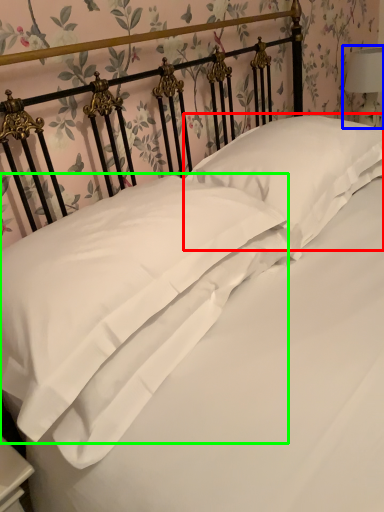
Question: Which is farther away from pillow (highlighted by a red box)? bedside lamp (highlighted by a blue box) or pillow (highlighted by a green box)?

Choices:
 (A) bedside lamp
 (B) pillow

Answer: (A)